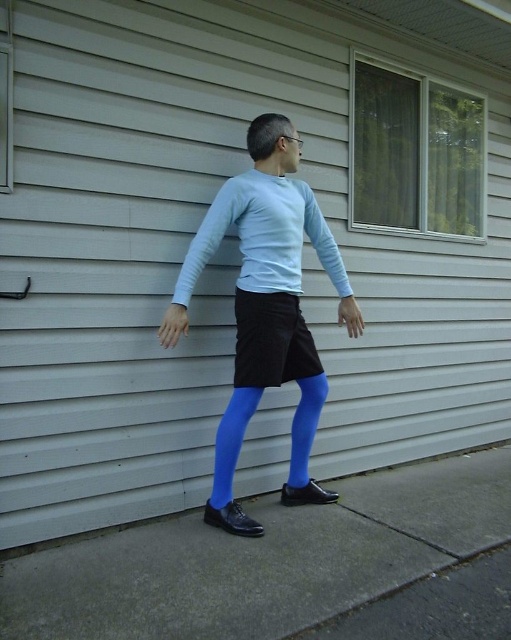
Does smooth concrete pavement at lower center have a larger size compared to matte blue tights at center?

No.

Which is in front, point (254, 508) or point (254, 173)?

Point (254, 173) is more forward.

Which is behind, point (129, 616) or point (249, 209)?

Positioned behind is point (249, 209).

This screenshot has height=640, width=511. I want to click on smooth concrete pavement at lower center, so click(263, 561).

Does light blue matte long-sleeve shirt at center have a greater width compared to blue tights at lower center?

Yes, light blue matte long-sleeve shirt at center is wider than blue tights at lower center.

Is point (211, 250) closer to camera compared to point (320, 400)?

Yes, point (211, 250) is closer to viewer.

Which is in front, point (220, 237) or point (304, 467)?

Point (220, 237)

The image size is (511, 640). I want to click on light blue matte long-sleeve shirt at center, so coord(264,236).

I want to click on matte blue tights at center, so click(266, 308).

Which is above, matte blue tights at center or blue matte tights at center?

Positioned higher is matte blue tights at center.

Is point (227, 481) in front of point (224, 445)?

No, (227, 481) is further to viewer.

The width and height of the screenshot is (511, 640). Identify the location of matte blue tights at center. (266, 308).